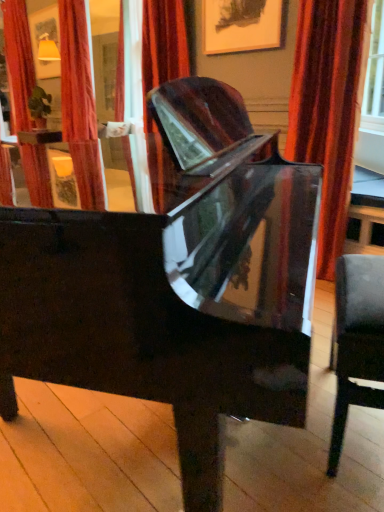
What do you see at coordinates (328, 109) in the screenshot?
I see `velvet-like red curtain at right, which is the first curtain in bottom-to-top order` at bounding box center [328, 109].

In order to face glossy black piano at center, should I rotate leftwards or rightwards?

Turn left approximately 9.206 degrees to face it.

Image resolution: width=384 pixels, height=512 pixels. Find the location of `glossy black piano at center`. glossy black piano at center is located at coordinates (171, 278).

Where is `velvet-like red curtain at right, marked as the first curtain in a right-to-left arrangement`? This screenshot has width=384, height=512. velvet-like red curtain at right, marked as the first curtain in a right-to-left arrangement is located at coordinates (328, 109).

How much distance is there between glossy black piano at center and velvet-like red curtain at right, which is counted as the second curtain, starting from the left?

3.77 feet.

Relative to velvet-like red curtain at right, which is counted as the second curtain, starting from the left, is glossy black piano at center in front or behind?

In the image, glossy black piano at center appears in front of velvet-like red curtain at right, which is counted as the second curtain, starting from the left.

Do you think glossy black piano at center is within velvet-like red curtain at right, which is counted as the second curtain, starting from the left, or outside of it?

glossy black piano at center is spatially situated outside velvet-like red curtain at right, which is counted as the second curtain, starting from the left.

From a real-world perspective, between glossy black piano at center and velvet-like red curtain at right, the second curtain viewed from the back, who is vertically higher?

velvet-like red curtain at right, the second curtain viewed from the back, from a real-world perspective.

Does velvet red curtain at upper left, positioned as the 2th curtain in right-to-left order, come in front of velvet-like red curtain at right, which is the first curtain in bottom-to-top order?

That is False.

In the scene shown: From a real-world perspective, is velvet red curtain at upper left, marked as the second curtain in a bottom-to-top arrangement, positioned above or below velvet-like red curtain at right, which is the first curtain in bottom-to-top order?

From a real-world perspective, velvet red curtain at upper left, marked as the second curtain in a bottom-to-top arrangement, is physically above velvet-like red curtain at right, which is the first curtain in bottom-to-top order.

Which is more distant, (x=21, y=159) or (x=350, y=114)?

The point (x=350, y=114) is more distant.

Looking at the image, does velvet red curtain at upper left, which is the 2th curtain from front to back, seem bigger or smaller compared to velvet-like red curtain at right, the second curtain viewed from the back?

Clearly, velvet red curtain at upper left, which is the 2th curtain from front to back, is larger in size than velvet-like red curtain at right, the second curtain viewed from the back.

From a real-world perspective, is leather-like black chair at right physically below glossy black piano at center?

Indeed, from a real-world perspective, leather-like black chair at right is positioned beneath glossy black piano at center.

Considering the relative positions of leather-like black chair at right and glossy black piano at center in the image provided, is leather-like black chair at right to the left of glossy black piano at center from the viewer's perspective?

No, leather-like black chair at right is not to the left of glossy black piano at center.

From the image's perspective, is leather-like black chair at right on top of glossy black piano at center?

No.

Is the depth of leather-like black chair at right less than that of glossy black piano at center?

No, the depth of leather-like black chair at right is greater than that of glossy black piano at center.

From the picture: Considering the relative positions of velvet red curtain at upper left, the 1th curtain from the back, and glossy black piano at center in the image provided, is velvet red curtain at upper left, the 1th curtain from the back, behind glossy black piano at center?

Yes, the depth of velvet red curtain at upper left, the 1th curtain from the back, is greater than that of glossy black piano at center.

From the image's perspective, is velvet red curtain at upper left, the first curtain viewed from the left, on top of glossy black piano at center?

Yes, from the image's perspective, velvet red curtain at upper left, the first curtain viewed from the left, is over glossy black piano at center.

Can you confirm if velvet red curtain at upper left, positioned as the 2th curtain in right-to-left order, is thinner than glossy black piano at center?

Yes, velvet red curtain at upper left, positioned as the 2th curtain in right-to-left order, is thinner than glossy black piano at center.

Which is more to the left, velvet red curtain at upper left, marked as the second curtain in a bottom-to-top arrangement, or glossy black piano at center?

Positioned to the left is velvet red curtain at upper left, marked as the second curtain in a bottom-to-top arrangement.

From the image's perspective, does glossy black piano at center appear higher than velvet red curtain at upper left, positioned as the 2th curtain in right-to-left order?

No, from the image's perspective, glossy black piano at center is not above velvet red curtain at upper left, positioned as the 2th curtain in right-to-left order.

Locate an element on the screen. curtain that is the 2nd object located behind the glossy black piano at center is located at coordinates (18, 62).

Between glossy black piano at center and velvet red curtain at upper left, the 1th curtain from the back, which one has smaller size?

velvet red curtain at upper left, the 1th curtain from the back, is smaller.

How different are the orientations of glossy black piano at center and velvet red curtain at upper left, marked as the second curtain in a bottom-to-top arrangement, in degrees?

The angular difference between glossy black piano at center and velvet red curtain at upper left, marked as the second curtain in a bottom-to-top arrangement, is 58 degrees.

Is velvet red curtain at upper left, the first curtain viewed from the left, inside the boundaries of leather-like black chair at right, or outside?

velvet red curtain at upper left, the first curtain viewed from the left, is located beyond the bounds of leather-like black chair at right.

Is velvet red curtain at upper left, the 1th curtain from the back, positioned with its back to leather-like black chair at right?

No, velvet red curtain at upper left, the 1th curtain from the back, is not facing away from leather-like black chair at right.

From the image's perspective, is velvet red curtain at upper left, which is the 2th curtain from front to back, above or below leather-like black chair at right?

velvet red curtain at upper left, which is the 2th curtain from front to back, is above leather-like black chair at right.

Which object is closer to the camera, velvet red curtain at upper left, the first curtain in the top-to-bottom sequence, or leather-like black chair at right?

leather-like black chair at right.

Is leather-like black chair at right far away from velvet-like red curtain at right, the second curtain viewed from the back?

Yes, leather-like black chair at right and velvet-like red curtain at right, the second curtain viewed from the back, are quite far apart.

Can you confirm if leather-like black chair at right is smaller than velvet-like red curtain at right, which is the second curtain from top to bottom?

Yes.

Is leather-like black chair at right wider or thinner than velvet-like red curtain at right, the second curtain viewed from the back?

Clearly, leather-like black chair at right has less width compared to velvet-like red curtain at right, the second curtain viewed from the back.

The image size is (384, 512). In the image, there is a velvet-like red curtain at right, which is counted as the second curtain, starting from the left. What are the coordinates of `piano below it (from the image's perspective)` in the screenshot? It's located at (171, 278).

This screenshot has height=512, width=384. What are the coordinates of `curtain on the left of velvet-like red curtain at right, marked as the first curtain in a right-to-left arrangement` in the screenshot? It's located at (18, 62).

When comparing their distances from leather-like black chair at right, does velvet-like red curtain at right, the second curtain viewed from the back, or glossy black piano at center seem further?

The object further to leather-like black chair at right is velvet-like red curtain at right, the second curtain viewed from the back.

Looking at the image, which one is located further to velvet-like red curtain at right, which is counted as the second curtain, starting from the left, velvet red curtain at upper left, which is the 2th curtain from front to back, or glossy black piano at center?

Based on the image, velvet red curtain at upper left, which is the 2th curtain from front to back, appears to be further to velvet-like red curtain at right, which is counted as the second curtain, starting from the left.

Based on their spatial positions, is velvet red curtain at upper left, the first curtain viewed from the left, or glossy black piano at center closer to leather-like black chair at right?

glossy black piano at center.

From the image, which object appears to be farther from velvet red curtain at upper left, the first curtain viewed from the left, glossy black piano at center or leather-like black chair at right?

leather-like black chair at right lies further to velvet red curtain at upper left, the first curtain viewed from the left, than the other object.

When comparing their distances from velvet-like red curtain at right, which is the second curtain from top to bottom, does leather-like black chair at right or glossy black piano at center seem closer?

Based on the image, glossy black piano at center appears to be nearer to velvet-like red curtain at right, which is the second curtain from top to bottom.

When comparing their distances from leather-like black chair at right, does glossy black piano at center or velvet red curtain at upper left, the first curtain viewed from the left, seem further?

velvet red curtain at upper left, the first curtain viewed from the left, is further to leather-like black chair at right.

Estimate the real-world distances between objects in this image. Which object is further from glossy black piano at center, leather-like black chair at right or velvet-like red curtain at right, which is the first curtain in bottom-to-top order?

The object further to glossy black piano at center is velvet-like red curtain at right, which is the first curtain in bottom-to-top order.

In the scene shown: When comparing their distances from glossy black piano at center, does velvet-like red curtain at right, which is the second curtain from top to bottom, or velvet red curtain at upper left, the first curtain viewed from the left, seem further?

Among the two, velvet red curtain at upper left, the first curtain viewed from the left, is located further to glossy black piano at center.

The height and width of the screenshot is (512, 384). Find the location of `curtain located between leather-like black chair at right and velvet red curtain at upper left, positioned as the 2th curtain in right-to-left order, in the depth direction`. curtain located between leather-like black chair at right and velvet red curtain at upper left, positioned as the 2th curtain in right-to-left order, in the depth direction is located at coordinates (328, 109).

You are a GUI agent. You are given a task and a screenshot of the screen. Output one action in this format:
    pyautogui.click(x=<x>, y=<y>)
    Task: Click on the curtain between glossy black piano at center and velvet red curtain at upper left, positioned as the 2th curtain in right-to-left order, from front to back
    
    Given the screenshot: What is the action you would take?
    pyautogui.click(x=328, y=109)

I want to click on chair located between glossy black piano at center and velvet-like red curtain at right, marked as the first curtain in a right-to-left arrangement, in the depth direction, so click(356, 341).

Where is `chair between glossy black piano at center and velvet red curtain at upper left, positioned as the 2th curtain in right-to-left order, along the z-axis`? chair between glossy black piano at center and velvet red curtain at upper left, positioned as the 2th curtain in right-to-left order, along the z-axis is located at coordinates (356, 341).